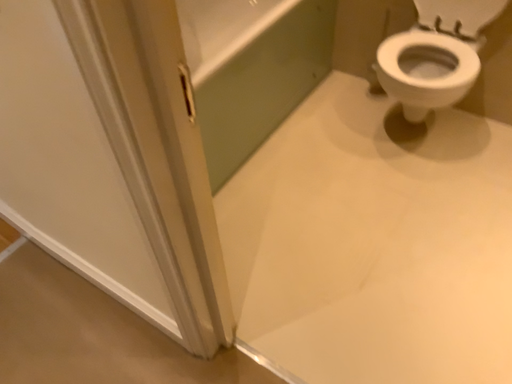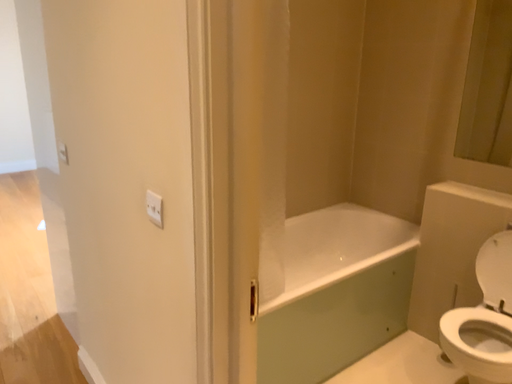
Question: Which way did the camera rotate in the video?

Choices:
 (A) rotated left
 (B) rotated right

Answer: (A)